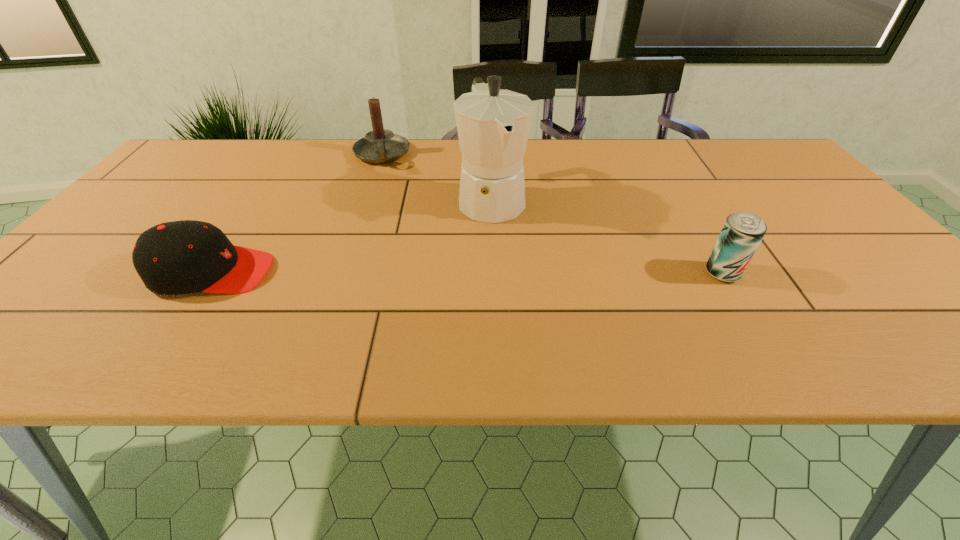
The width and height of the screenshot is (960, 540). Find the location of `vacant space at the right edge of the desktop`. vacant space at the right edge of the desktop is located at coordinates (820, 203).

I want to click on free space between the tallest object and the beer can, so click(607, 235).

This screenshot has width=960, height=540. Identify the location of empty location between the third object from left to right and the third object from right to left. (437, 176).

Locate an element on the screen. free space between the shortest object and the rightmost object is located at coordinates (468, 273).

The image size is (960, 540). I want to click on free space between the tallest object and the cap, so click(351, 235).

At what (x,y) coordinates should I click in order to perform the action: click on free space between the second object from left to right and the shortest object. Please return your answer as a coordinate pair (x, y). Looking at the image, I should click on (297, 213).

You are a GUI agent. You are given a task and a screenshot of the screen. Output one action in this format:
    pyautogui.click(x=<x>, y=<y>)
    Task: Click on the empty space between the shortest object and the tallest object
    
    Given the screenshot: What is the action you would take?
    pyautogui.click(x=351, y=235)

You are a GUI agent. You are given a task and a screenshot of the screen. Output one action in this format:
    pyautogui.click(x=<x>, y=<y>)
    Task: Click on the vacant region between the second tallest object and the tallest object
    The width and height of the screenshot is (960, 540).
    Given the screenshot: What is the action you would take?
    pyautogui.click(x=437, y=176)

The image size is (960, 540). I want to click on empty space that is in between the second object from left to right and the rightmost object, so click(x=552, y=214).

I want to click on free space between the beer can and the leftmost object, so click(x=468, y=273).